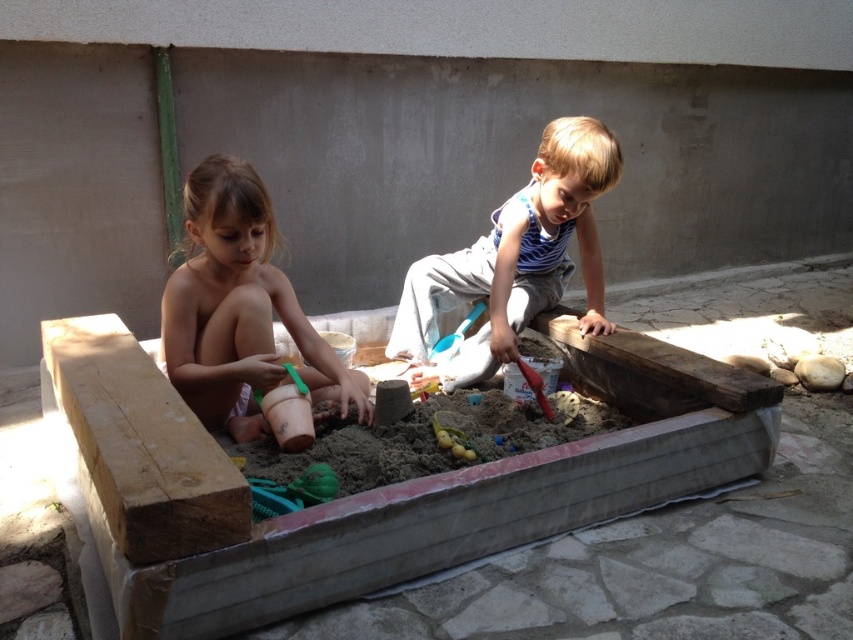
Question: Which of the following is the closest to the observer?

Choices:
 (A) blue plastic shovel at center
 (B) striped cotton shirt at center

Answer: (B)

Question: Which point is closer to the camera?

Choices:
 (A) blue plastic shovel at center
 (B) smooth skin girl at left
 (C) striped cotton shirt at center

Answer: (B)

Question: Based on their relative distances, which object is farther from the smooth skin girl at left?

Choices:
 (A) striped cotton shirt at center
 (B) blue plastic shovel at center

Answer: (B)

Question: Is smooth skin girl at left behind blue plastic shovel at center?

Choices:
 (A) no
 (B) yes

Answer: (A)

Question: Is striped cotton shirt at center wider than blue plastic shovel at center?

Choices:
 (A) yes
 (B) no

Answer: (A)

Question: Does smooth skin girl at left have a lesser width compared to striped cotton shirt at center?

Choices:
 (A) yes
 (B) no

Answer: (A)